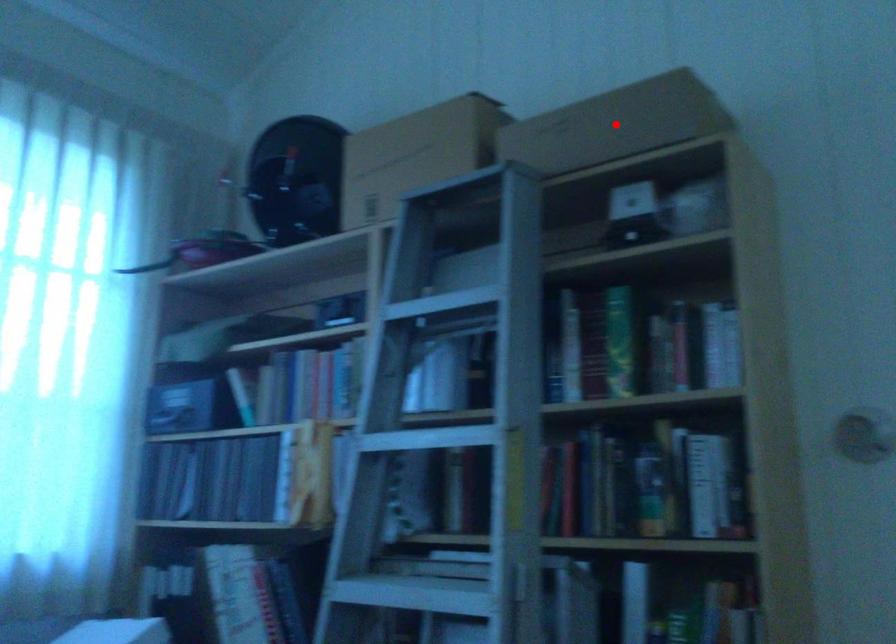
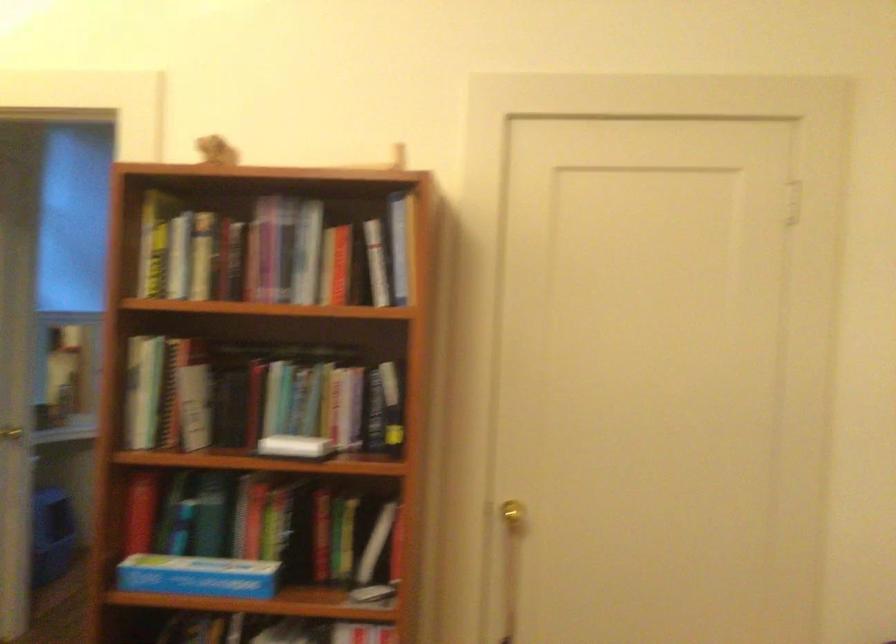
Question: I am providing you with two images of the same scene from different viewpoints. A red point is marked on the first image. Is the red point's position out of view in image 2?

Choices:
 (A) Yes
 (B) No

Answer: (A)